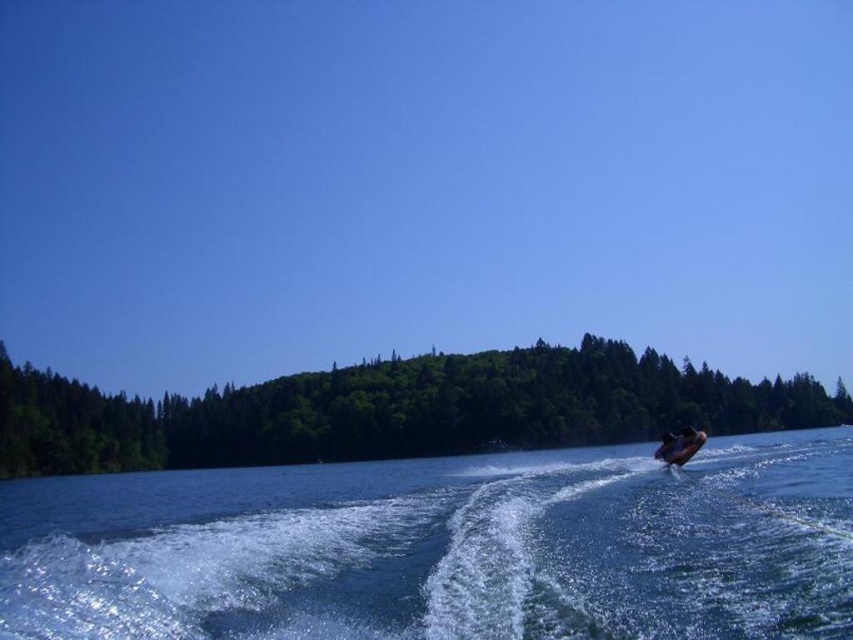
You are standing at the point with coordinates point (656,456) and want to move to the point with coordinates point (351,442). According to the scene, will the jet ski be visible to you while moving towards your destination?

Point (351,442) is behind point (656,456), so the jet ski will not be visible to you while moving towards your destination.

You are standing at the point marked by coordinates point (444, 547). Looking around, what do you see in the scene described?

You are standing at the point marked by coordinates point (444, 547), which is located in the clear blue water at lower right. The scene around you includes a vibrant outdoor setting with a clear blue sky above and a dense line of evergreen trees forming a lush forest in the middle. The jet ski is moving on the water to your left, leaving a trail of white frothy waves behind it.